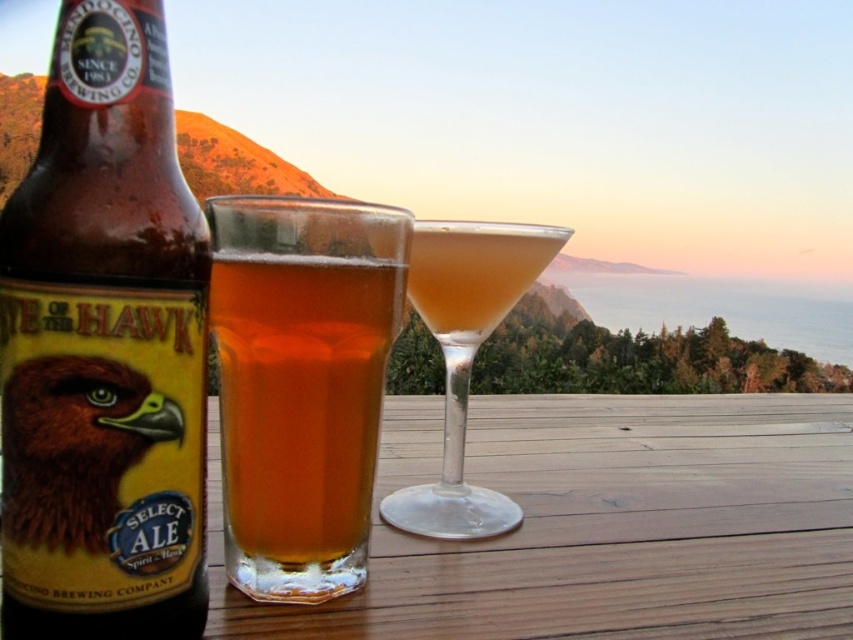
Is point (305, 348) more distant than point (21, 388)?

Yes, point (305, 348) is behind point (21, 388).

Can you confirm if translucent glass beer at center is positioned below brown feathered eagle at lower left?

No.

Measure the distance between translucent glass beer at center and camera.

The distance of translucent glass beer at center from camera is 6.51 inches.

The image size is (853, 640). In order to click on translucent glass beer at center in this screenshot , I will do `click(300, 384)`.

Is brown glass bottle at left to the left of translucent glass beer at center from the viewer's perspective?

Correct, you'll find brown glass bottle at left to the left of translucent glass beer at center.

Describe the element at coordinates (103, 348) in the screenshot. This screenshot has width=853, height=640. I see `brown glass bottle at left` at that location.

Find the location of a particular element. brown glass bottle at left is located at coordinates [103, 348].

Is brown glass bottle at left shorter than translucent glass cocktail at center?

No, brown glass bottle at left is not shorter than translucent glass cocktail at center.

Is brown glass bottle at left taller than translucent glass cocktail at center?

Indeed, brown glass bottle at left has a greater height compared to translucent glass cocktail at center.

Between point (184, 600) and point (440, 480), which one is positioned in front?

Point (184, 600)

The image size is (853, 640). What are the coordinates of `brown glass bottle at left` in the screenshot? It's located at (103, 348).